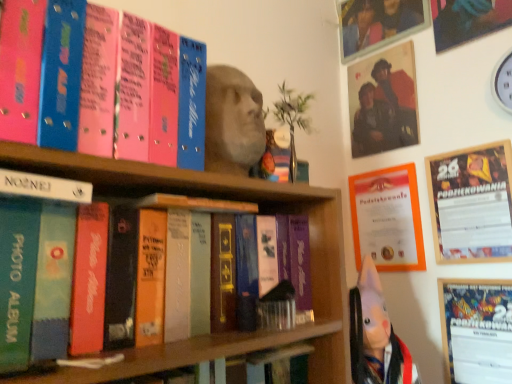
Question: Considering the relative positions of orange paper certificate at upper right and white plastic clock at upper right in the image provided, is orange paper certificate at upper right behind white plastic clock at upper right?

Choices:
 (A) no
 (B) yes

Answer: (B)

Question: Is the depth of orange paper certificate at upper right less than that of white plastic clock at upper right?

Choices:
 (A) yes
 (B) no

Answer: (B)

Question: Is orange paper certificate at upper right beside white plastic clock at upper right?

Choices:
 (A) no
 (B) yes

Answer: (A)

Question: Would you say orange paper certificate at upper right contains white plastic clock at upper right?

Choices:
 (A) no
 (B) yes

Answer: (A)

Question: Is orange paper certificate at upper right shorter than white plastic clock at upper right?

Choices:
 (A) no
 (B) yes

Answer: (A)

Question: Considering the positions of matte plastic photo frame at upper right, the first picture frame viewed from the left, and white matte photo album at left, marked as the 2th book in a top-to-bottom arrangement, in the image, is matte plastic photo frame at upper right, the first picture frame viewed from the left, taller or shorter than white matte photo album at left, marked as the 2th book in a top-to-bottom arrangement,?

Choices:
 (A) tall
 (B) short

Answer: (A)

Question: From a real-world perspective, is matte plastic photo frame at upper right, placed as the first picture frame when sorted from top to bottom, physically located above or below white matte photo album at left, marked as the 2th book in a top-to-bottom arrangement?

Choices:
 (A) below
 (B) above

Answer: (B)

Question: Choose the correct answer: Is matte plastic photo frame at upper right, the first picture frame from the back, inside white matte photo album at left, marked as the 2th book in a top-to-bottom arrangement, or outside it?

Choices:
 (A) outside
 (B) inside

Answer: (A)

Question: Is matte plastic photo frame at upper right, arranged as the 2th picture frame when ordered from the bottom, to the left or to the right of white matte photo album at left, marked as the 2th book in a top-to-bottom arrangement, in the image?

Choices:
 (A) left
 (B) right

Answer: (B)

Question: From the image's perspective, is wooden frame at upper right, the first picture frame positioned from the right, positioned above or below orange paper certificate at upper right?

Choices:
 (A) below
 (B) above

Answer: (B)

Question: From a real-world perspective, is wooden frame at upper right, which is counted as the first picture frame, starting from the front, physically located above or below orange paper certificate at upper right?

Choices:
 (A) above
 (B) below

Answer: (A)

Question: Is point (501, 198) closer or farther from the camera than point (402, 175)?

Choices:
 (A) closer
 (B) farther

Answer: (A)

Question: Based on their positions, is wooden frame at upper right, marked as the 2th picture frame in a back-to-front arrangement, located to the left or right of orange paper certificate at upper right?

Choices:
 (A) left
 (B) right

Answer: (B)

Question: From a real-world perspective, is pink matte photo album at upper left, positioned as the second book in bottom-to-top order, above or below matte plastic photo frame at upper right, the 2th picture frame positioned from the right?

Choices:
 (A) below
 (B) above

Answer: (A)

Question: Visually, is pink matte photo album at upper left, positioned as the second book in bottom-to-top order, positioned to the left or to the right of matte plastic photo frame at upper right, the 2th picture frame positioned from the right?

Choices:
 (A) right
 (B) left

Answer: (B)